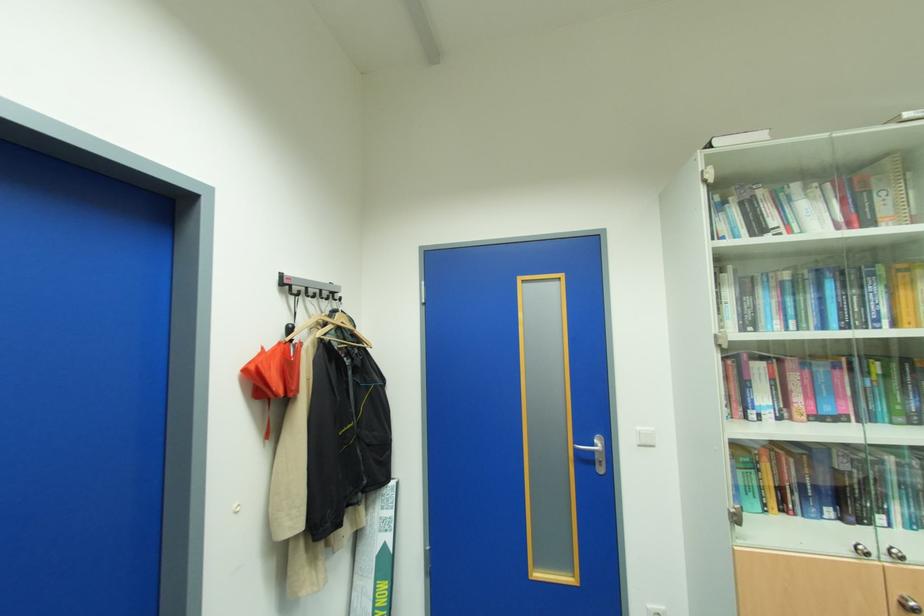
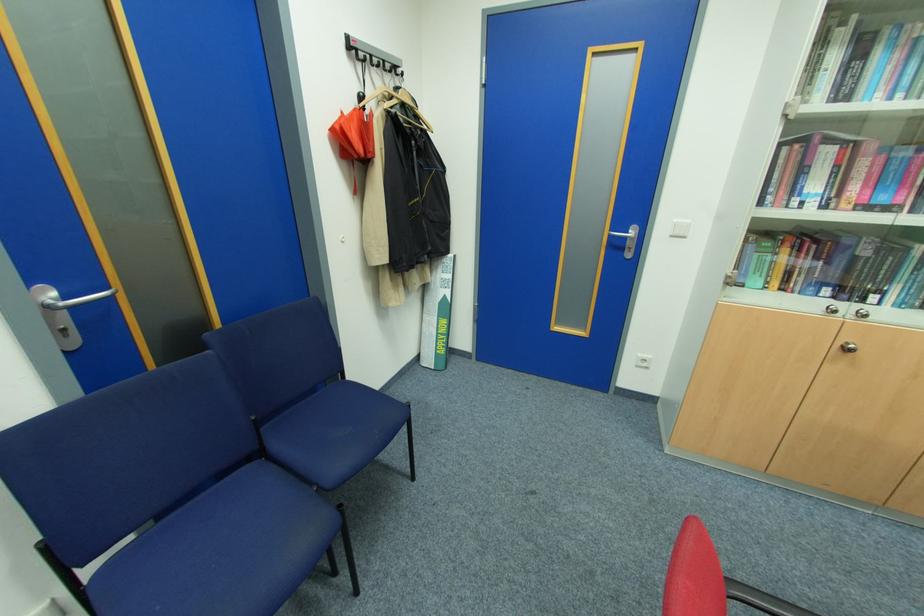
Where in the second image is the point corresponding to (x=285, y=292) from the first image?

(353, 55)